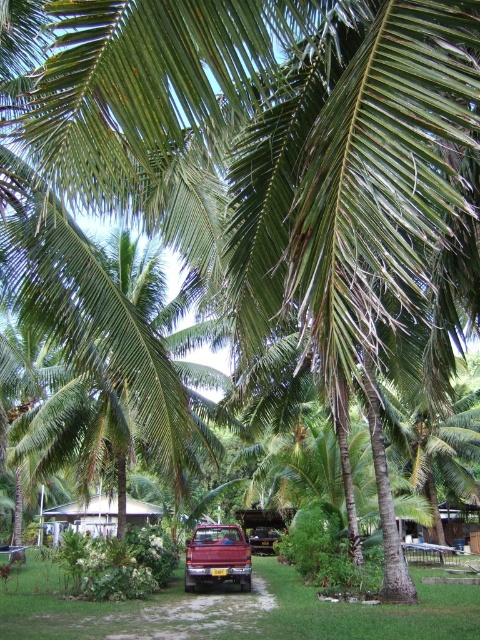
In the scene shown: Who is more forward, (250, 572) or (264, 552)?

Positioned in front is point (250, 572).

Does shiny red truck at center appear over metallic red car at center?

Indeed, shiny red truck at center is positioned over metallic red car at center.

Locate an element on the screen. shiny red truck at center is located at coordinates (216, 556).

Can you confirm if white corrugated metal hut at center is positioned to the right of metallic red car at center?

In fact, white corrugated metal hut at center is to the left of metallic red car at center.

Is point (70, 506) farther from camera compared to point (271, 540)?

Yes, it is.

Is point (41, 518) closer to viewer compared to point (274, 552)?

No, it is behind (274, 552).

Locate an element on the screen. The image size is (480, 640). white corrugated metal hut at center is located at coordinates (83, 516).

Between point (196, 570) and point (152, 522), which one is positioned in front?

Positioned in front is point (196, 570).

Can you confirm if shiny red truck at center is positioned above white corrugated metal hut at center?

Yes.

Measure the distance between shiny red truck at center and camera.

shiny red truck at center is 14.55 meters from camera.

Find the location of a particular element. shiny red truck at center is located at coordinates (216, 556).